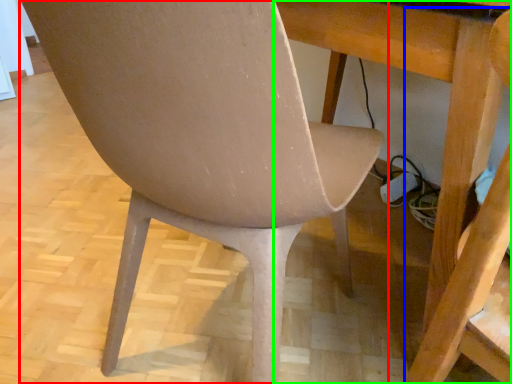
Question: Which is nearer to the chair (highlighted by a red box)? swivel chair (highlighted by a blue box) or table (highlighted by a green box).

Choices:
 (A) swivel chair
 (B) table

Answer: (B)